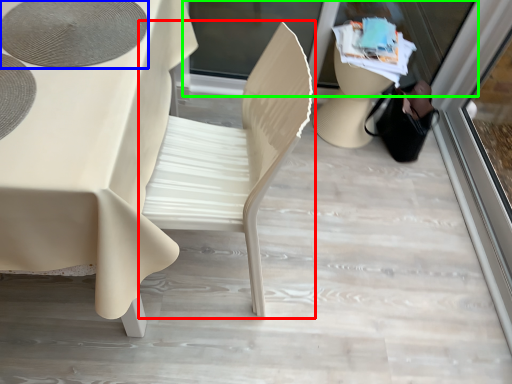
Question: Which object is positioned farthest from chair (highlighted by a red box)? Select from oval (highlighted by a blue box) and shop window (highlighted by a green box).

Choices:
 (A) oval
 (B) shop window

Answer: (B)